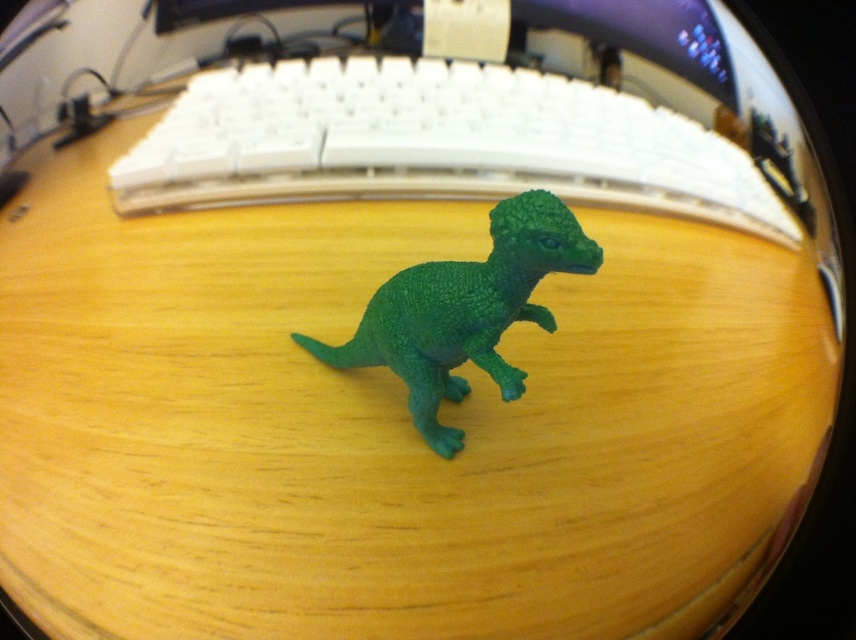
Which is in front, point (128, 179) or point (397, 346)?

Point (397, 346) is more forward.

Is white plastic keyboard at center below green matte plastic dinosaur at center?

Incorrect, white plastic keyboard at center is not positioned below green matte plastic dinosaur at center.

Is point (177, 125) farther from camera compared to point (502, 307)?

That is True.

At what (x,y) coordinates should I click in order to perform the action: click on white plastic keyboard at center. Please return your answer as a coordinate pair (x, y). The image size is (856, 640). Looking at the image, I should click on (435, 141).